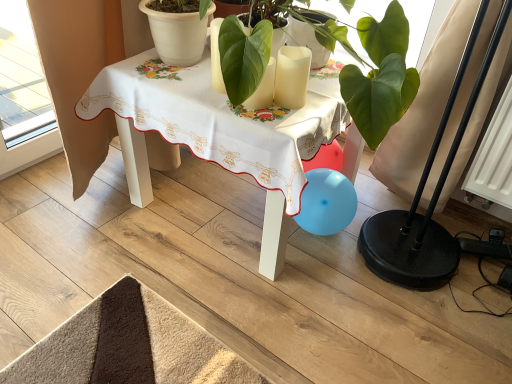
Identify the location of free point below white fabric table at center (from a real-world perspective). The width and height of the screenshot is (512, 384). (213, 208).